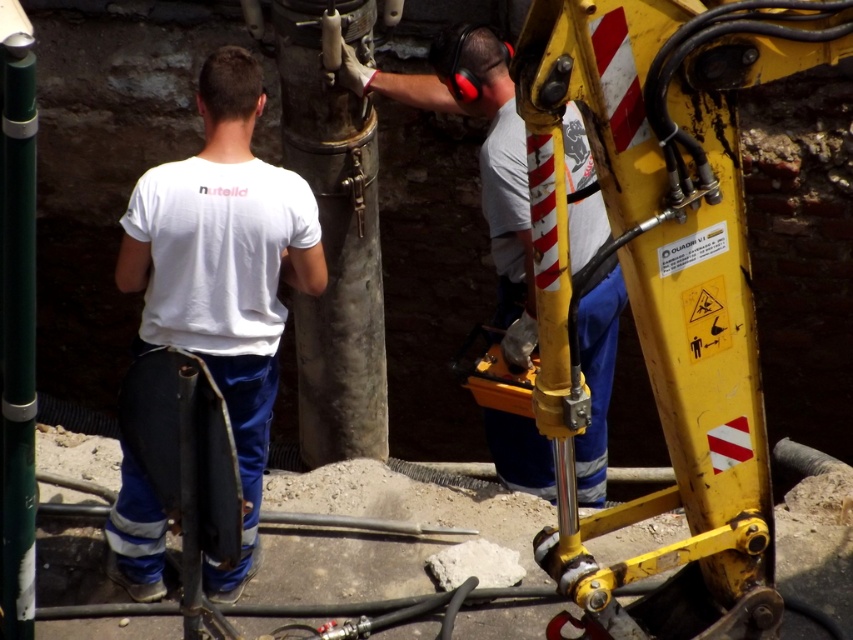
You are a safety inspector at the construction site. You notice two items at the center of the scene. Which item is closer to you, the white cotton shirt at center or the matte yellow tool at center?

The white cotton shirt at center is closer to you since it is in front of the matte yellow tool at center according to the description.

You are a safety inspector observing the construction site. You notice the white cotton shirt at center and the matte yellow tool at center. According to safety protocols, tools must be kept above workers to prevent accidental drops. Is this setup compliant with safety standards?

The white cotton shirt at center is located below the matte yellow tool at center, which violates safety protocols as tools should be kept above workers to prevent accidental drops.

You are a safety inspector observing the construction site. You notice a white cotton shirt at center and a matte yellow tool at center. According to safety protocols, tools must be placed to the right of any clothing items to prevent contamination. Is the current arrangement compliant with the safety rule?

The white cotton shirt at center is to the left of the matte yellow tool at center, which violates the safety rule requiring tools to be placed to the right of clothing items to prevent contamination.